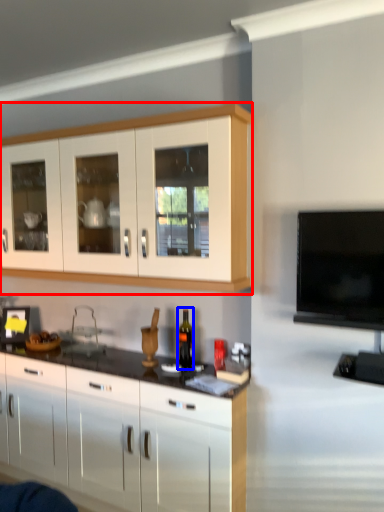
Question: Which of the following is the closest to the observer, cabinetry (highlighted by a red box) or bottle (highlighted by a blue box)?

Choices:
 (A) cabinetry
 (B) bottle

Answer: (A)